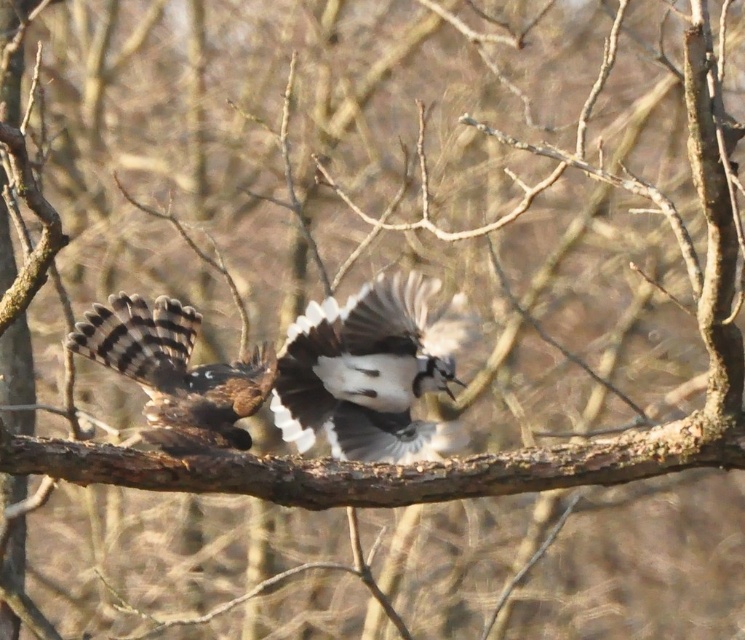
Question: Is white glossy bird at center below brown speckled hawk at left?

Choices:
 (A) yes
 (B) no

Answer: (A)

Question: Does white glossy bird at center appear on the right side of brown speckled hawk at left?

Choices:
 (A) yes
 (B) no

Answer: (A)

Question: Among these objects, which one is farthest from the camera?

Choices:
 (A) white glossy bird at center
 (B) brown speckled hawk at left

Answer: (A)

Question: In this image, where is white glossy bird at center located relative to brown speckled hawk at left?

Choices:
 (A) right
 (B) left

Answer: (A)